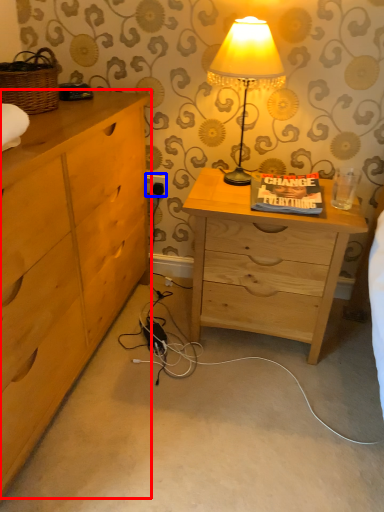
Question: Which object is further to the camera taking this photo, chest of drawers (highlighted by a red box) or electric outlet (highlighted by a blue box)?

Choices:
 (A) chest of drawers
 (B) electric outlet

Answer: (B)